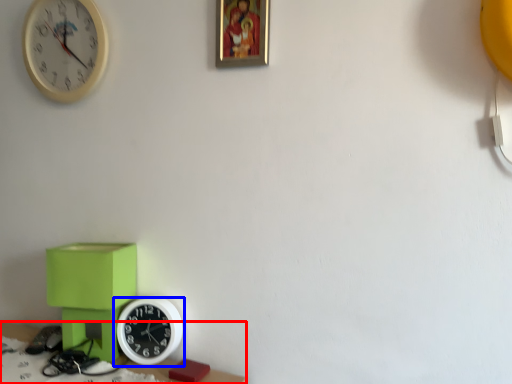
Question: Which object appears farthest to the camera in this image, table (highlighted by a red box) or wall clock (highlighted by a blue box)?

Choices:
 (A) table
 (B) wall clock

Answer: (B)